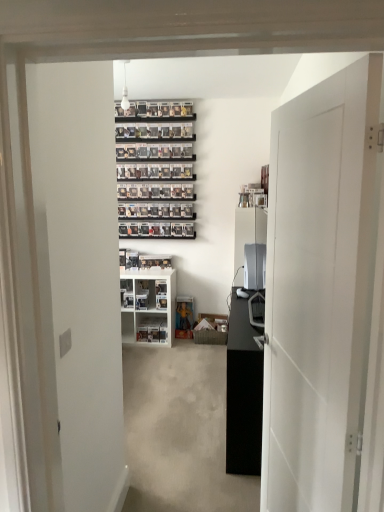
Describe the element at coordinates (319, 290) in the screenshot. The image size is (384, 512). I see `white matte door at right` at that location.

The image size is (384, 512). I want to click on black matte cabinet at center, so click(x=243, y=394).

Image resolution: width=384 pixels, height=512 pixels. I want to click on white plastic shelf at center, placed as the 2th shelf when sorted from top to bottom, so [152, 329].

Considering the sizes of objects white plastic shelf at center, which is the 2th shelf from bottom to top, and white matte door at right in the image provided, who is wider, white plastic shelf at center, which is the 2th shelf from bottom to top, or white matte door at right?

Wider between the two is white plastic shelf at center, which is the 2th shelf from bottom to top.

From a real-world perspective, is white plastic shelf at center, which is the 2th shelf from bottom to top, located higher than white matte door at right?

No.

Are white plastic shelf at center, acting as the first shelf starting from the top, and white matte door at right far apart?

white plastic shelf at center, acting as the first shelf starting from the top, is positioned a significant distance from white matte door at right.

From the image's perspective, is white plastic shelf at center, acting as the first shelf starting from the top, above white matte door at right?

Actually, white plastic shelf at center, acting as the first shelf starting from the top, appears below white matte door at right in the image.

Is the surface of satin silver desktop at center in direct contact with white plastic shelf at center, acting as the first shelf starting from the top?

No, satin silver desktop at center is not with white plastic shelf at center, acting as the first shelf starting from the top.

Considering the relative sizes of satin silver desktop at center and white plastic shelf at center, which is the 2th shelf from bottom to top, in the image provided, is satin silver desktop at center smaller than white plastic shelf at center, which is the 2th shelf from bottom to top,?

Indeed, satin silver desktop at center has a smaller size compared to white plastic shelf at center, which is the 2th shelf from bottom to top.

Would you say satin silver desktop at center is outside white plastic shelf at center, acting as the first shelf starting from the top?

satin silver desktop at center is positioned outside white plastic shelf at center, acting as the first shelf starting from the top.

From a real-world perspective, is satin silver desktop at center physically above white plastic shelf at center, which is the 2th shelf from bottom to top?

Yes.

Who is taller, white matte door at right or white plastic shelf at center, arranged as the first shelf when ordered from the bottom?

With more height is white matte door at right.

From a real-world perspective, relative to white plastic shelf at center, placed as the 2th shelf when sorted from top to bottom, is white matte door at right vertically above or below?

From a real-world perspective, white matte door at right is physically above white plastic shelf at center, placed as the 2th shelf when sorted from top to bottom.

From the white matte door at right, count the 1st shelf to the left and point to it. Please provide its 2D coordinates.

[(152, 329)]

Looking at their sizes, would you say white matte door at right is wider or thinner than white plastic shelf at center, placed as the 2th shelf when sorted from top to bottom?

Considering their sizes, white matte door at right looks slimmer than white plastic shelf at center, placed as the 2th shelf when sorted from top to bottom.

Is white matte door at right positioned behind black matte cabinet at center?

No.

Looking at this image, can you tell me how much white matte door at right and black matte cabinet at center differ in facing direction?

The angle between the facing direction of white matte door at right and the facing direction of black matte cabinet at center is 11.6 degrees.

From a real-world perspective, is white matte door at right beneath black matte cabinet at center?

No, from a real-world perspective, white matte door at right is not under black matte cabinet at center.

Does white matte door at right turn towards black matte cabinet at center?

No.

Can you confirm if white plastic shelf at center, placed as the 2th shelf when sorted from top to bottom, is smaller than white plastic shelf at center, which is the 2th shelf from bottom to top?

Yes.

Is point (162, 340) less distant than point (156, 271)?

No, (162, 340) is further to viewer.

From the picture: Is white plastic shelf at center, arranged as the first shelf when ordered from the bottom, with black matte cabinet at center?

No.

Is white plastic shelf at center, arranged as the first shelf when ordered from the bottom, looking in the opposite direction of black matte cabinet at center?

white plastic shelf at center, arranged as the first shelf when ordered from the bottom, does not have its back to black matte cabinet at center.

Between white plastic shelf at center, arranged as the first shelf when ordered from the bottom, and black matte cabinet at center, which one appears on the left side from the viewer's perspective?

Positioned to the left is white plastic shelf at center, arranged as the first shelf when ordered from the bottom.

Does white plastic shelf at center, arranged as the first shelf when ordered from the bottom, have a greater height compared to black matte cabinet at center?

No, white plastic shelf at center, arranged as the first shelf when ordered from the bottom, is not taller than black matte cabinet at center.

Considering the positions of objects white plastic shelf at center, which is the 2th shelf from bottom to top, and black matte cabinet at center in the image provided, who is behind, white plastic shelf at center, which is the 2th shelf from bottom to top, or black matte cabinet at center?

white plastic shelf at center, which is the 2th shelf from bottom to top, is behind.

Consider the image. From a real-world perspective, which is physically below, white plastic shelf at center, acting as the first shelf starting from the top, or black matte cabinet at center?

black matte cabinet at center, from a real-world perspective.

Is point (156, 311) closer or farther from the camera than point (237, 403)?

Point (156, 311) is positioned farther from the camera compared to point (237, 403).

Looking at their sizes, would you say white plastic shelf at center, which is the 2th shelf from bottom to top, is wider or thinner than black matte cabinet at center?

In the image, white plastic shelf at center, which is the 2th shelf from bottom to top, appears to be wider than black matte cabinet at center.

You are a GUI agent. You are given a task and a screenshot of the screen. Output one action in this format:
    pyautogui.click(x=<x>, y=<y>)
    Task: Click on the door to the right of white plastic shelf at center, acting as the first shelf starting from the top
    The image size is (384, 512).
    Given the screenshot: What is the action you would take?
    pyautogui.click(x=319, y=290)

Locate an element on the screen. shelf that is the 1st object located below the satin silver desktop at center (from the image's perspective) is located at coordinates (148, 306).

From the image, which object appears to be farther from white plastic shelf at center, acting as the first shelf starting from the top, satin silver desktop at center or black matte cabinet at center?

black matte cabinet at center is positioned further to the anchor white plastic shelf at center, acting as the first shelf starting from the top.

Considering their positions, is white plastic shelf at center, placed as the 2th shelf when sorted from top to bottom, positioned further to white plastic shelf at center, acting as the first shelf starting from the top, than satin silver desktop at center?

satin silver desktop at center is positioned further to the anchor white plastic shelf at center, acting as the first shelf starting from the top.

Estimate the real-world distances between objects in this image. Which object is closer to white plastic shelf at center, acting as the first shelf starting from the top, white matte door at right or satin silver desktop at center?

Based on the image, satin silver desktop at center appears to be nearer to white plastic shelf at center, acting as the first shelf starting from the top.

Estimate the real-world distances between objects in this image. Which object is further from satin silver desktop at center, white matte door at right or white plastic shelf at center, acting as the first shelf starting from the top?

Based on the image, white matte door at right appears to be further to satin silver desktop at center.

When comparing their distances from white matte door at right, does white plastic shelf at center, arranged as the first shelf when ordered from the bottom, or black matte cabinet at center seem further?

Among the two, white plastic shelf at center, arranged as the first shelf when ordered from the bottom, is located further to white matte door at right.

Which object lies nearer to the anchor point white plastic shelf at center, arranged as the first shelf when ordered from the bottom, white plastic shelf at center, which is the 2th shelf from bottom to top, or satin silver desktop at center?

white plastic shelf at center, which is the 2th shelf from bottom to top, is closer to white plastic shelf at center, arranged as the first shelf when ordered from the bottom.

When comparing their distances from black matte cabinet at center, does satin silver desktop at center or white matte door at right seem closer?

white matte door at right.

Which object lies further to the anchor point white plastic shelf at center, arranged as the first shelf when ordered from the bottom, black matte cabinet at center or white matte door at right?

white matte door at right is further to white plastic shelf at center, arranged as the first shelf when ordered from the bottom.

The image size is (384, 512). In order to click on cabinetry positioned between white matte door at right and white plastic shelf at center, which is the 2th shelf from bottom to top, from near to far in this screenshot , I will do `click(243, 394)`.

Where is `desktop computer between black matte cabinet at center and white plastic shelf at center, which is the 2th shelf from bottom to top, along the z-axis`? The width and height of the screenshot is (384, 512). desktop computer between black matte cabinet at center and white plastic shelf at center, which is the 2th shelf from bottom to top, along the z-axis is located at coordinates (254, 266).

At what (x,y) coordinates should I click in order to perform the action: click on cabinetry between white matte door at right and satin silver desktop at center in the front-back direction. Please return your answer as a coordinate pair (x, y). This screenshot has width=384, height=512. Looking at the image, I should click on (243, 394).

Find the location of a particular element. shelf between white matte door at right and white plastic shelf at center, arranged as the first shelf when ordered from the bottom, along the z-axis is located at coordinates (148, 306).